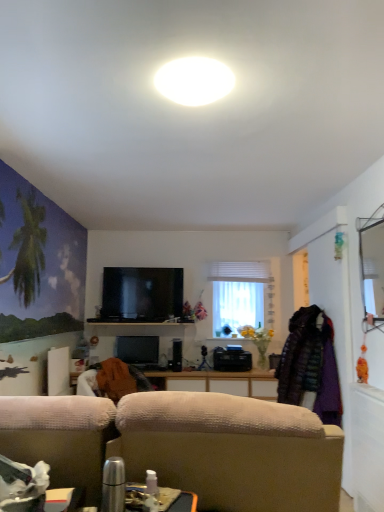
Find the location of a particular element. blank space situated above black glossy flat-screen tv at center, the first television viewed from the top (from a real-world perspective) is located at coordinates (152, 267).